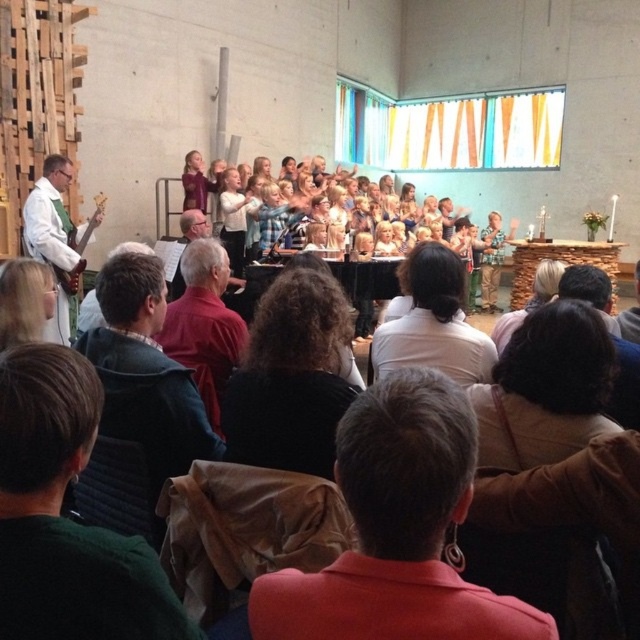
Is red shirt at center bigger than blonde hair at upper left?

Yes, red shirt at center is bigger than blonde hair at upper left.

Between red shirt at center and blonde hair at upper left, which one is positioned lower?

Positioned lower is red shirt at center.

Is point (227, 276) farther from viewer compared to point (19, 289)?

Yes, point (227, 276) is farther from viewer.

Where is `red shirt at center`? The width and height of the screenshot is (640, 640). red shirt at center is located at coordinates [204, 317].

Is point (282, 371) positioned in front of point (637, 296)?

Yes, it is.

Is dark brown hair at center positioned before brown leather jacket at lower right?

Yes, it is in front of brown leather jacket at lower right.

I want to click on dark brown hair at center, so click(291, 378).

You are a GUI agent. You are given a task and a screenshot of the screen. Output one action in this format:
    pyautogui.click(x=<x>, y=<y>)
    Task: Click on the dark brown hair at center
    The width and height of the screenshot is (640, 640).
    Given the screenshot: What is the action you would take?
    pyautogui.click(x=291, y=378)

Between red fabric jacket at center and blonde hair at upper left, which one appears on the right side from the viewer's perspective?

Positioned to the right is red fabric jacket at center.

Can you confirm if red fabric jacket at center is taller than blonde hair at upper left?

Correct, red fabric jacket at center is much taller as blonde hair at upper left.

The image size is (640, 640). What are the coordinates of `red fabric jacket at center` in the screenshot? It's located at (397, 531).